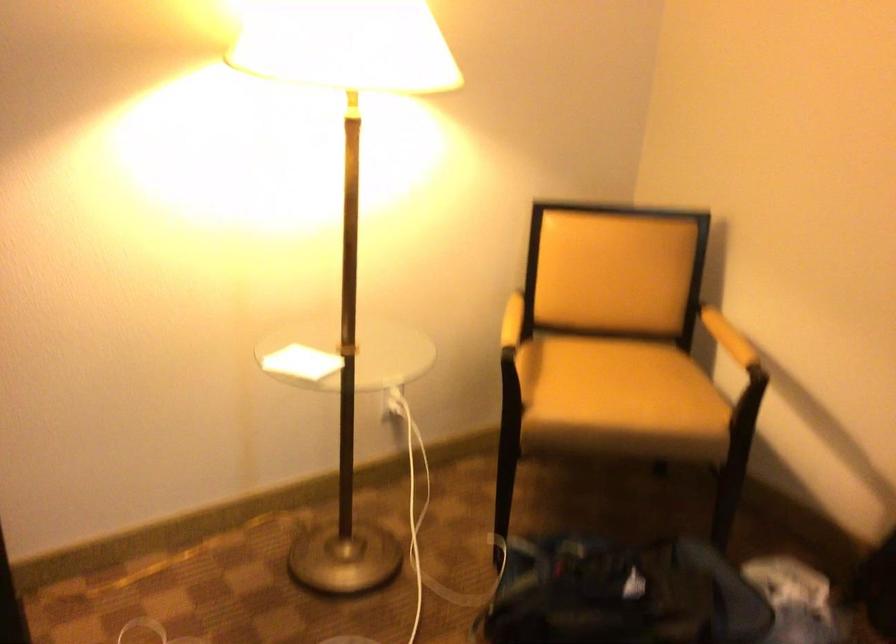
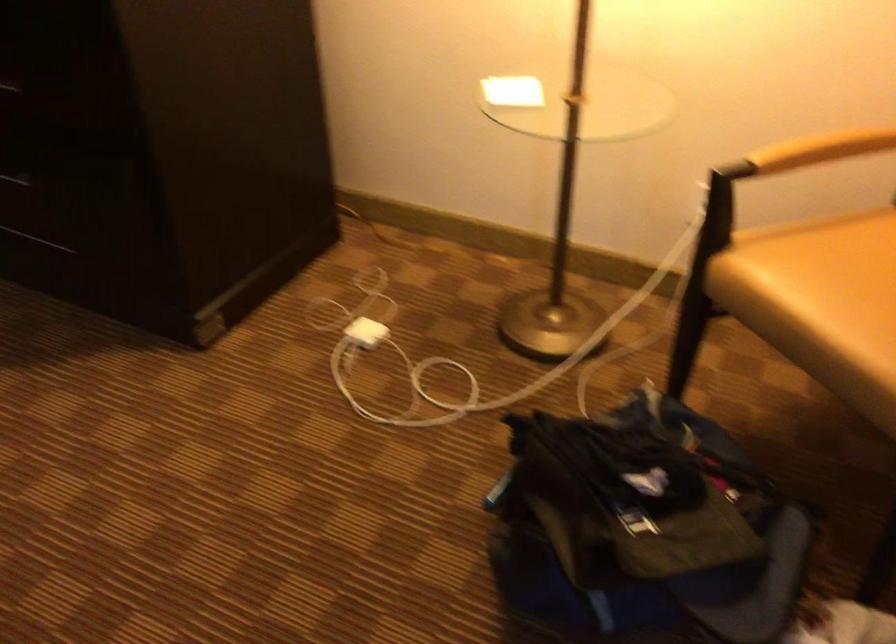
The point at (x=619, y=411) is marked in the first image. Where is the corresponding point in the second image?

(821, 303)